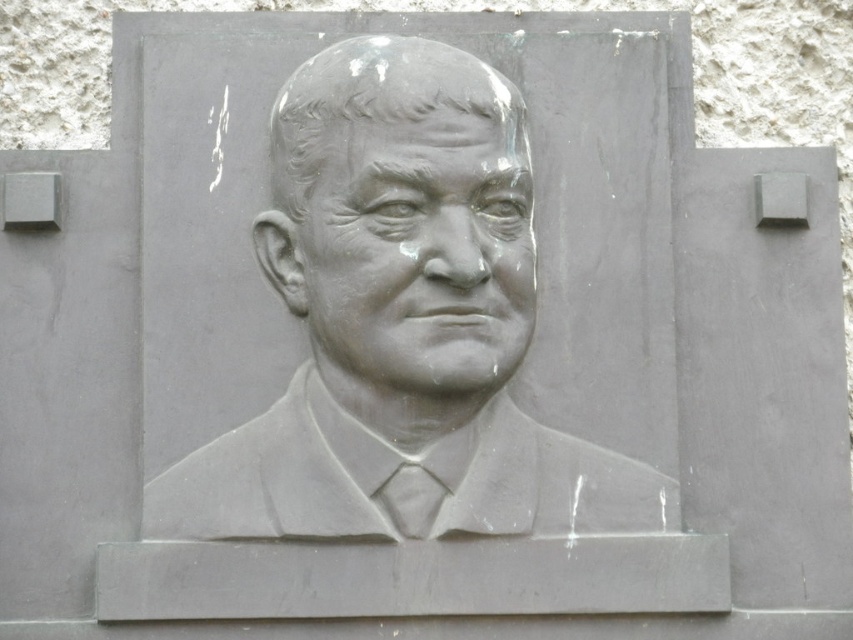
Question: Can you confirm if gray stone relief at center is bigger than gray stone face at center?

Choices:
 (A) no
 (B) yes

Answer: (B)

Question: Which point is farther to the camera?

Choices:
 (A) (357, 372)
 (B) (486, 148)

Answer: (A)

Question: Which point is closer to the camera?

Choices:
 (A) (421, 224)
 (B) (642, 376)

Answer: (A)

Question: Considering the relative positions of gray stone relief at center and gray stone face at center in the image provided, where is gray stone relief at center located with respect to gray stone face at center?

Choices:
 (A) below
 (B) above

Answer: (B)

Question: Is gray stone relief at center to the right of gray stone face at center from the viewer's perspective?

Choices:
 (A) no
 (B) yes

Answer: (B)